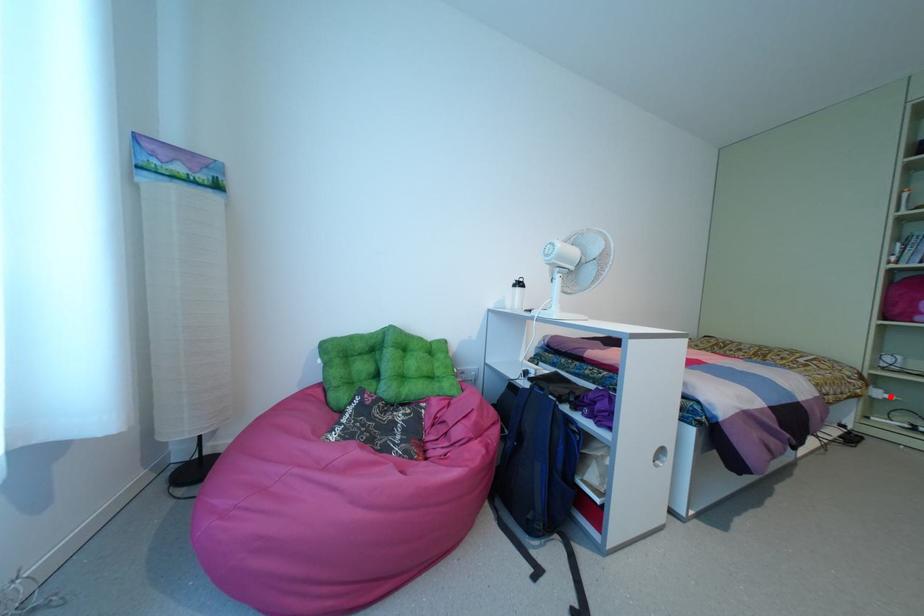
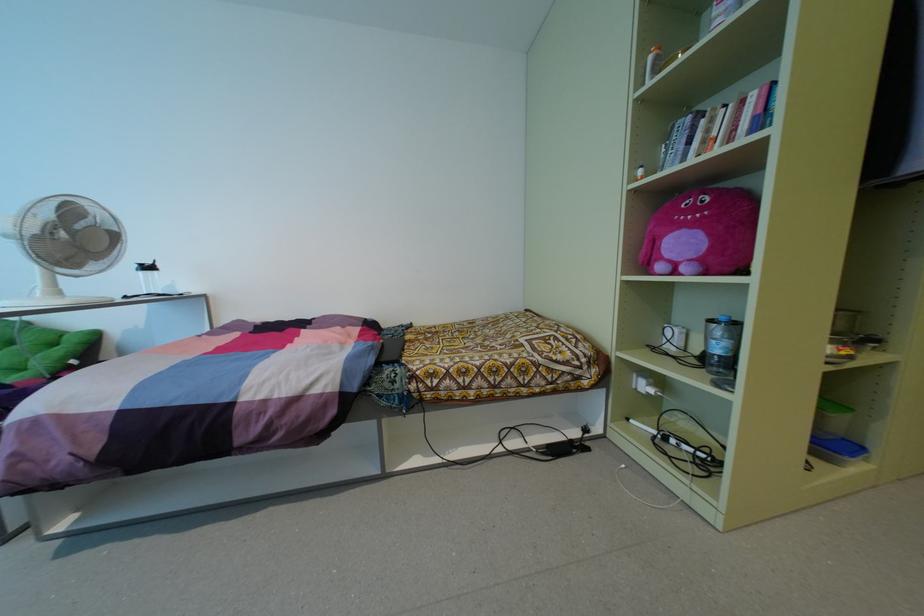
Find the pixel in the second image that matches the highlighted location in the first image.

(650, 390)